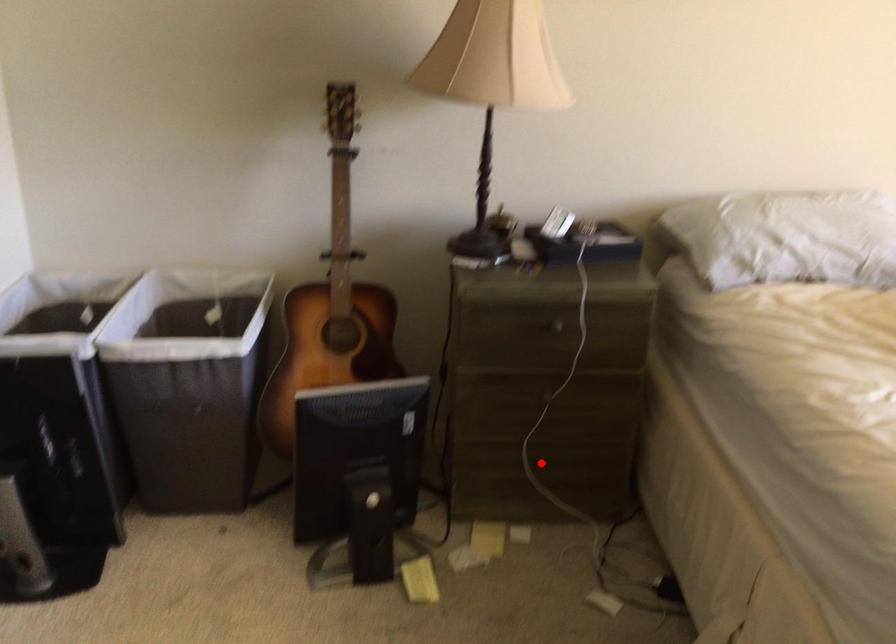
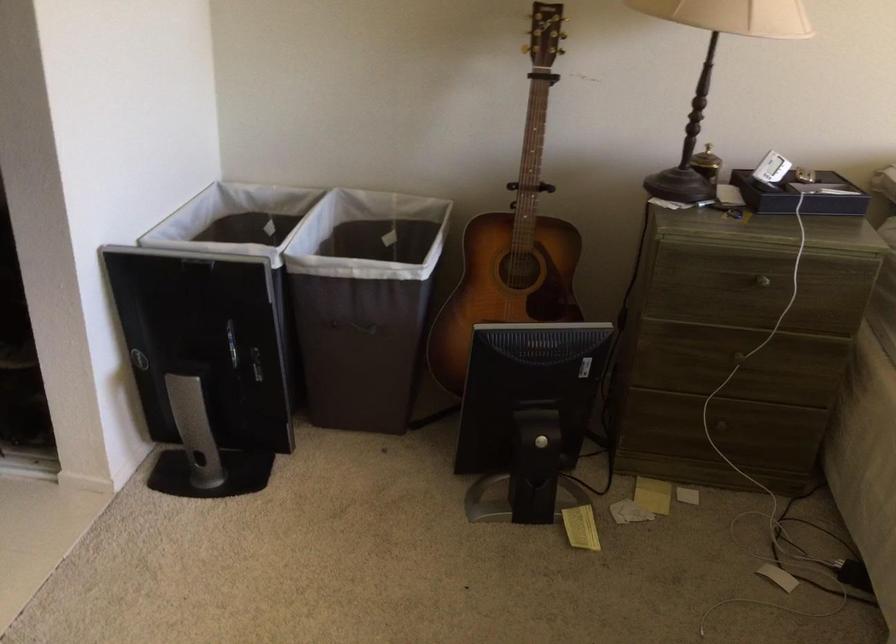
Locate, in the second image, the point that corresponds to the highlighted location in the first image.

(718, 427)